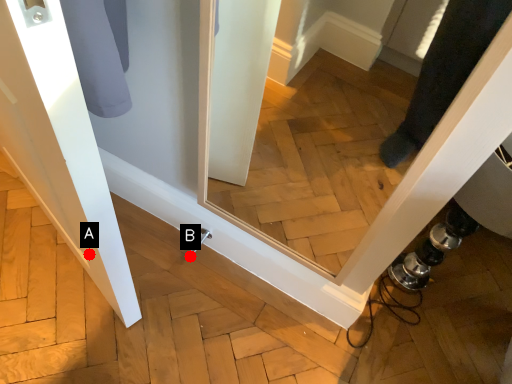
Question: Two points are circled on the image, labeled by A and B beside each circle. Among these points, which one is farthest from the camera?

Choices:
 (A) A is further
 (B) B is further

Answer: (B)